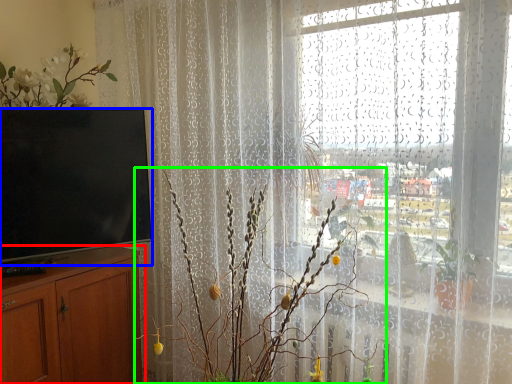
Question: Which is farther away from cabinetry (highlighted by a red box)? television (highlighted by a blue box) or floral arrangement (highlighted by a green box)?

Choices:
 (A) television
 (B) floral arrangement

Answer: (B)